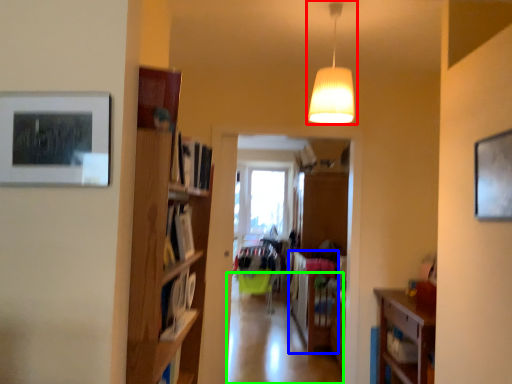
Question: Which object is positioned closest to lamp (highlighted by a red box)? Select from table (highlighted by a blue box) and aisle (highlighted by a green box).

Choices:
 (A) table
 (B) aisle

Answer: (A)